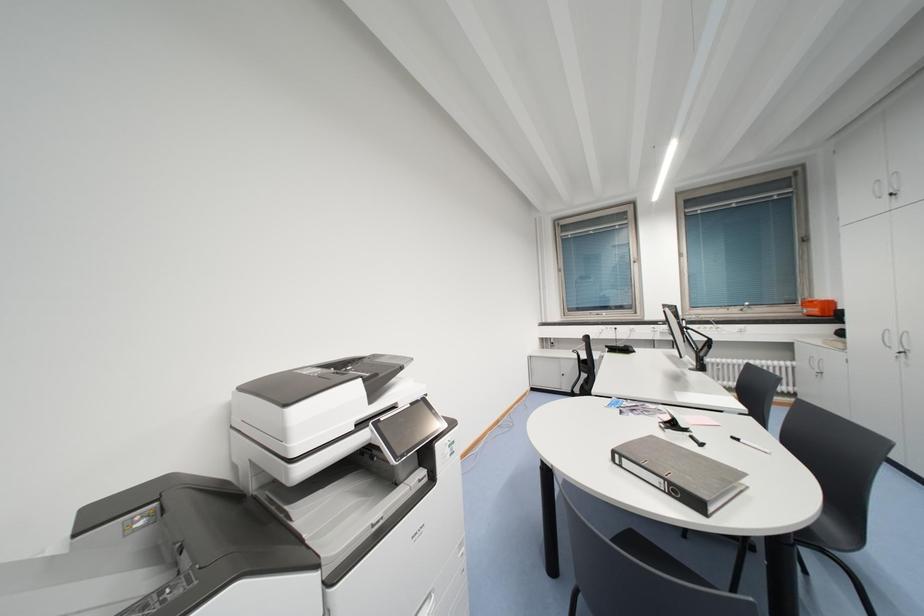
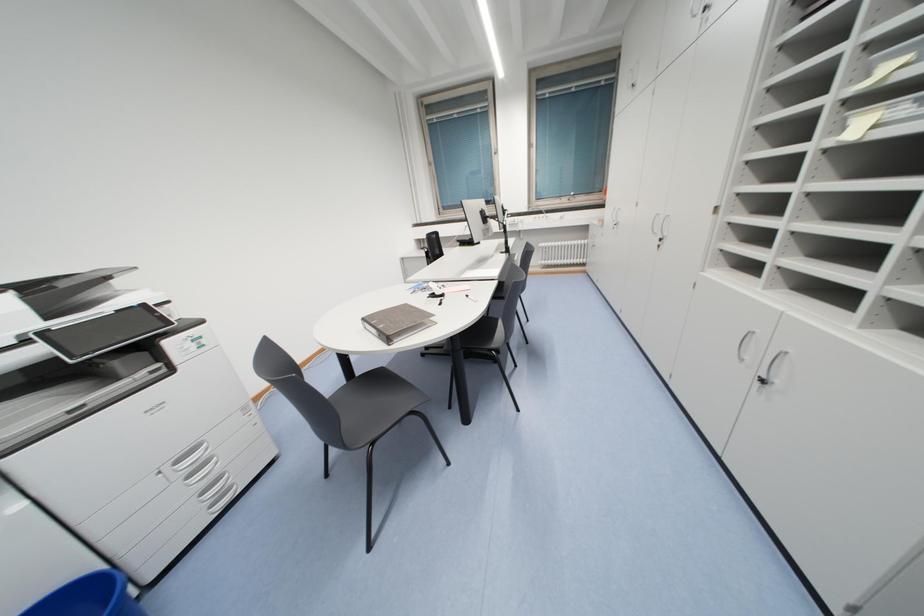
In a continuous first-person perspective shot, in which direction is the camera moving?

The cameraman moved toward right, backward.